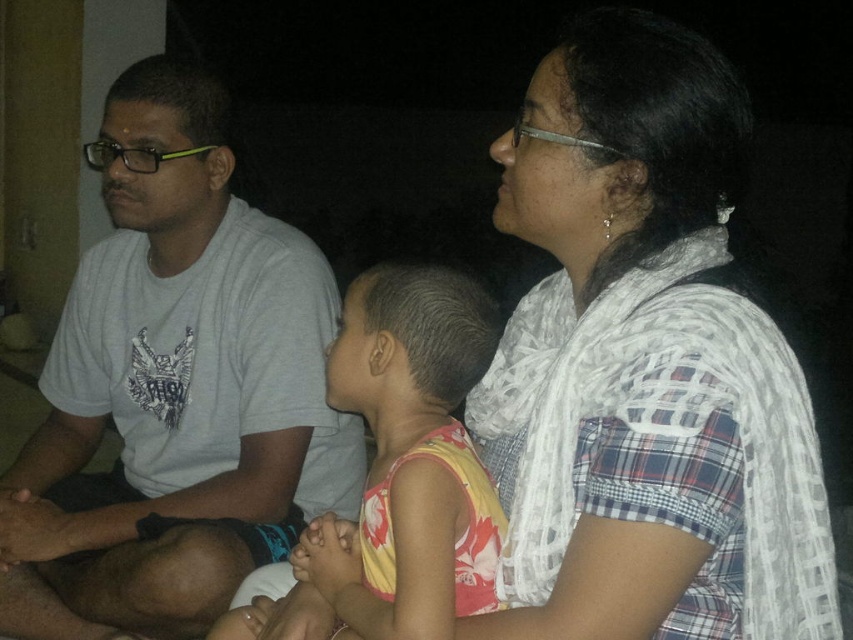
Question: Which point appears closest to the camera in this image?

Choices:
 (A) (415, 632)
 (B) (131, 532)
 (C) (718, 268)

Answer: (A)

Question: Is gray cotton t-shirt at left below floral fabric dress at center?

Choices:
 (A) no
 (B) yes

Answer: (A)

Question: Which object is farther from the camera taking this photo?

Choices:
 (A) gray cotton t-shirt at left
 (B) white plaid shirt at center
 (C) floral fabric dress at center

Answer: (A)

Question: Among these points, which one is nearest to the camera?

Choices:
 (A) (546, 132)
 (B) (460, 394)
 (C) (312, 497)

Answer: (A)

Question: Does gray cotton t-shirt at left have a smaller size compared to floral fabric dress at center?

Choices:
 (A) yes
 (B) no

Answer: (B)

Question: Does white plaid shirt at center appear on the right side of gray cotton t-shirt at left?

Choices:
 (A) no
 (B) yes

Answer: (B)